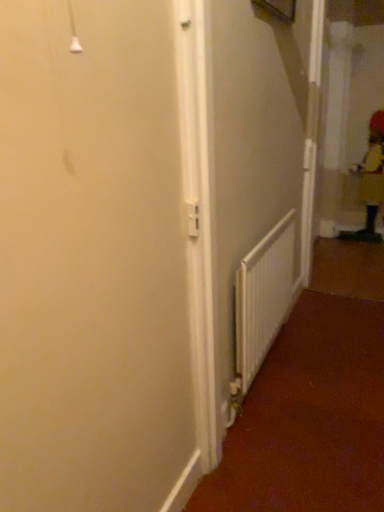
Question: In terms of width, does white matte radiator at center look wider or thinner when compared to yellow fabric worker at right?

Choices:
 (A) wide
 (B) thin

Answer: (B)

Question: Considering their positions, is white matte radiator at center located in front of or behind yellow fabric worker at right?

Choices:
 (A) behind
 (B) front

Answer: (B)

Question: From a real-world perspective, is white matte radiator at center physically located above or below yellow fabric worker at right?

Choices:
 (A) above
 (B) below

Answer: (B)

Question: Would you say yellow fabric worker at right is to the left or to the right of white matte radiator at center in the picture?

Choices:
 (A) left
 (B) right

Answer: (B)

Question: From the image's perspective, is yellow fabric worker at right positioned above or below white matte radiator at center?

Choices:
 (A) below
 (B) above

Answer: (B)

Question: Is yellow fabric worker at right in front of or behind white matte radiator at center in the image?

Choices:
 (A) front
 (B) behind

Answer: (B)

Question: Considering the positions of yellow fabric worker at right and white matte radiator at center in the image, is yellow fabric worker at right bigger or smaller than white matte radiator at center?

Choices:
 (A) big
 (B) small

Answer: (A)